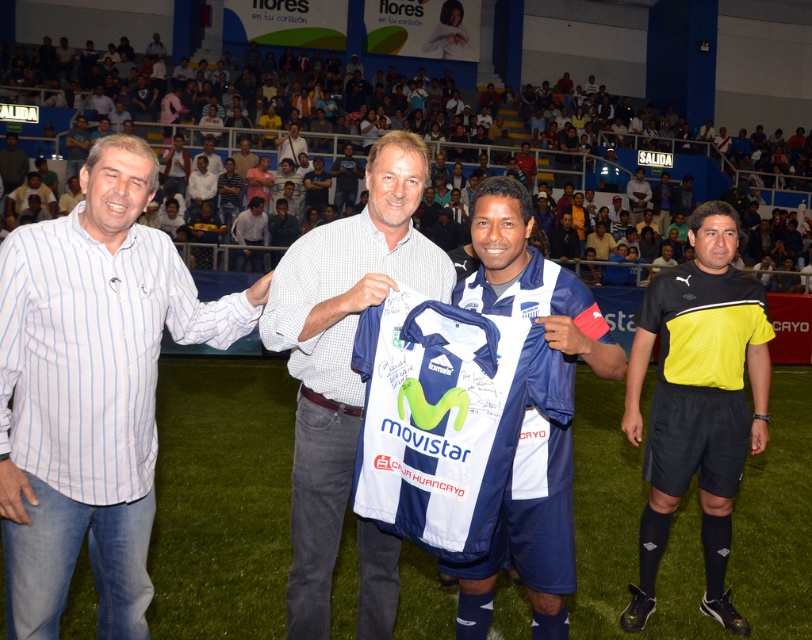
Question: Which object is positioned closest to the white striped shirt at left?

Choices:
 (A) white fabric jersey at center
 (B) white jersey at center
 (C) yellow/black jersey at right
 (D) white checkered shirt at center

Answer: (B)

Question: Which of the following is the farthest from the observer?

Choices:
 (A) pos(296,500)
 (B) pos(717,564)

Answer: (B)

Question: Can you confirm if white checkered shirt at center is bigger than white jersey at center?

Choices:
 (A) no
 (B) yes

Answer: (B)

Question: Can you confirm if white checkered shirt at center is thinner than white fabric jersey at center?

Choices:
 (A) no
 (B) yes

Answer: (A)

Question: Among these points, which one is farthest from the camera?

Choices:
 (A) (426, 243)
 (B) (370, 288)

Answer: (A)

Question: Is white striped shirt at left thinner than yellow/black jersey at right?

Choices:
 (A) yes
 (B) no

Answer: (B)